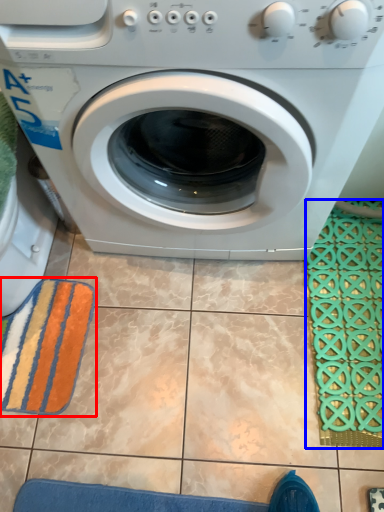
Question: Which object appears closest to the camera in this image, bath towel (highlighted by a red box) or bath mat (highlighted by a blue box)?

Choices:
 (A) bath towel
 (B) bath mat

Answer: (B)